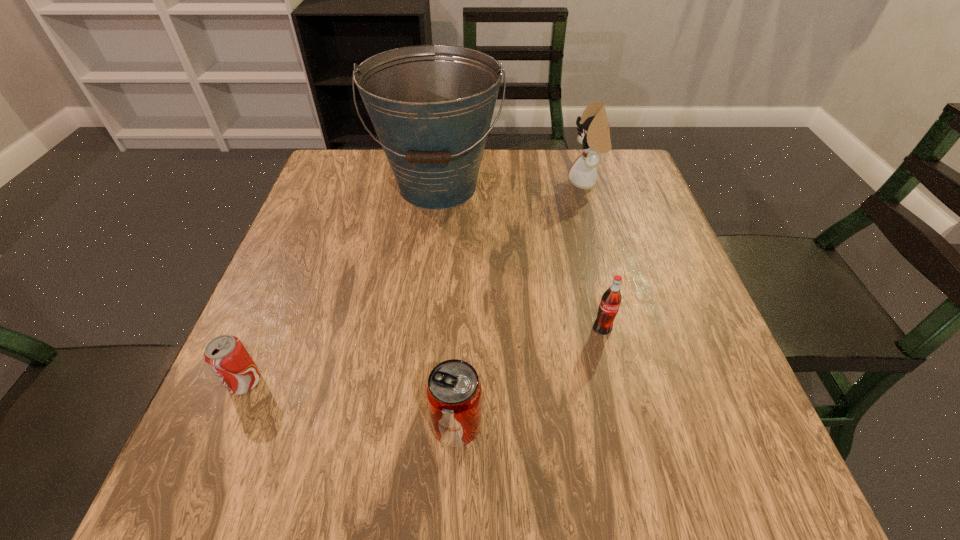
The image size is (960, 540). I want to click on bucket, so click(x=431, y=106).

Find the location of `the fourth shortest object`. the fourth shortest object is located at coordinates (595, 134).

Where is `the third farthest object`? Image resolution: width=960 pixels, height=540 pixels. the third farthest object is located at coordinates (611, 298).

The height and width of the screenshot is (540, 960). What are the coordinates of `the farthest soda can` in the screenshot? It's located at (611, 298).

Find the location of a particular element. the nearest object is located at coordinates (454, 394).

The image size is (960, 540). I want to click on the nearest soda can, so click(454, 394).

Locate an element on the screen. This screenshot has height=540, width=960. the leftmost object is located at coordinates (227, 357).

Find the location of a particular element. the second nearest soda can is located at coordinates (227, 357).

Locate an element on the screen. Image resolution: width=960 pixels, height=540 pixels. vacant space situated with the handle on opposite sides of the tallest object is located at coordinates pos(423,317).

Find the location of `free space located at the front face of the fourth shortest object`. free space located at the front face of the fourth shortest object is located at coordinates (449, 183).